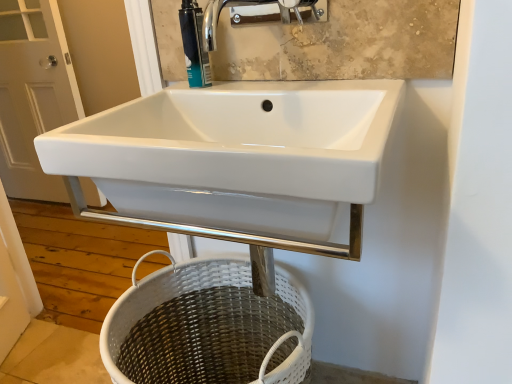
The width and height of the screenshot is (512, 384). Find the location of `white glossy sink at center`. white glossy sink at center is located at coordinates (234, 162).

This screenshot has width=512, height=384. Find the location of `white woven basket at lower center`. white woven basket at lower center is located at coordinates (208, 327).

The height and width of the screenshot is (384, 512). Identify the location of teal plastic soap dispenser at upper center. (194, 45).

Identify the location of white glossy sink at center. The height and width of the screenshot is (384, 512). (234, 162).

Can you confirm if white woven basket at lower center is wider than chrome metallic faucet at upper center?

Yes.

From the image's perspective, relative to chrome metallic faucet at upper center, is white woven basket at lower center above or below?

white woven basket at lower center is below chrome metallic faucet at upper center.

Would you say white woven basket at lower center is a long distance from chrome metallic faucet at upper center?

No, white woven basket at lower center is not far from chrome metallic faucet at upper center.

What are the coordinates of `basket behind the chrome metallic faucet at upper center` in the screenshot? It's located at (208, 327).

Could you tell me if teal plastic soap dispenser at upper center is turned towards chrome metallic faucet at upper center?

No, teal plastic soap dispenser at upper center is not aimed at chrome metallic faucet at upper center.

From a real-world perspective, does teal plastic soap dispenser at upper center sit lower than chrome metallic faucet at upper center?

Correct, in the physical world, teal plastic soap dispenser at upper center is lower than chrome metallic faucet at upper center.

Locate an element on the screen. The width and height of the screenshot is (512, 384). tap on the right of the teal plastic soap dispenser at upper center is located at coordinates (251, 6).

Between teal plastic soap dispenser at upper center and chrome metallic faucet at upper center, which one is positioned behind?

teal plastic soap dispenser at upper center is further from the camera.

Do you think white glossy sink at center is within chrome metallic faucet at upper center, or outside of it?

white glossy sink at center is located beyond the bounds of chrome metallic faucet at upper center.

Who is bigger, white glossy sink at center or chrome metallic faucet at upper center?

With larger size is white glossy sink at center.

Between white glossy sink at center and chrome metallic faucet at upper center, which one has less height?

Standing shorter between the two is chrome metallic faucet at upper center.

From the image's perspective, which is below, white glossy sink at center or chrome metallic faucet at upper center?

white glossy sink at center, from the image's perspective.

Where is `basket located underneath the teal plastic soap dispenser at upper center (from a real-world perspective)`? basket located underneath the teal plastic soap dispenser at upper center (from a real-world perspective) is located at coordinates (208, 327).

Looking at this image, is white woven basket at lower center outside of teal plastic soap dispenser at upper center?

Indeed, white woven basket at lower center is completely outside teal plastic soap dispenser at upper center.

From the image's perspective, is white woven basket at lower center on teal plastic soap dispenser at upper center?

No.

Looking at the image, does white woven basket at lower center seem bigger or smaller compared to teal plastic soap dispenser at upper center?

white woven basket at lower center is bigger than teal plastic soap dispenser at upper center.

From a real-world perspective, between white woven basket at lower center and white glossy sink at center, who is vertically higher?

In real-world perspective, white glossy sink at center is above.

Find the location of a particular element. The width and height of the screenshot is (512, 384). sink in front of the white woven basket at lower center is located at coordinates (234, 162).

Is point (144, 329) behind point (320, 112)?

Yes, it is.

How distant is white woven basket at lower center from white glossy sink at center?

white woven basket at lower center and white glossy sink at center are 11.92 inches apart from each other.

Is white glossy sink at center facing away from white woven basket at lower center?

No, white glossy sink at center's orientation is not away from white woven basket at lower center.

Considering the points (164, 122) and (206, 312), which point is behind, point (164, 122) or point (206, 312)?

The point (206, 312) is more distant.

From the image's perspective, would you say white glossy sink at center is shown under white woven basket at lower center?

No.

From the picture: From a real-world perspective, who is located higher, white glossy sink at center or white woven basket at lower center?

white glossy sink at center.

From the picture: Is chrome metallic faucet at upper center directly adjacent to white woven basket at lower center?

There is a gap between chrome metallic faucet at upper center and white woven basket at lower center.

Is chrome metallic faucet at upper center positioned behind white woven basket at lower center?

No.

Could you tell me if chrome metallic faucet at upper center is turned towards white woven basket at lower center?

No, chrome metallic faucet at upper center is not turned towards white woven basket at lower center.

Where is `tap above the white woven basket at lower center (from a real-world perspective)`? This screenshot has width=512, height=384. tap above the white woven basket at lower center (from a real-world perspective) is located at coordinates (251, 6).

In order to click on tap lying above the white woven basket at lower center (from the image's perspective) in this screenshot , I will do `click(251, 6)`.

Image resolution: width=512 pixels, height=384 pixels. I want to click on tap above the teal plastic soap dispenser at upper center (from a real-world perspective), so click(x=251, y=6).

When comparing their distances from white glossy sink at center, does white woven basket at lower center or white glossy door at left seem further?

Among the two, white glossy door at left is located further to white glossy sink at center.

Which object lies further to the anchor point white glossy door at left, teal plastic soap dispenser at upper center or white glossy sink at center?

The object further to white glossy door at left is white glossy sink at center.

Based on their spatial positions, is chrome metallic faucet at upper center or teal plastic soap dispenser at upper center closer to white glossy door at left?

Among the two, teal plastic soap dispenser at upper center is located nearer to white glossy door at left.

Considering their positions, is chrome metallic faucet at upper center positioned closer to teal plastic soap dispenser at upper center than white glossy sink at center?

chrome metallic faucet at upper center lies closer to teal plastic soap dispenser at upper center than the other object.

Based on their spatial positions, is teal plastic soap dispenser at upper center or white glossy door at left further from white glossy sink at center?

white glossy door at left lies further to white glossy sink at center than the other object.

From the image, which object appears to be nearer to white glossy door at left, white woven basket at lower center or white glossy sink at center?

Among the two, white woven basket at lower center is located nearer to white glossy door at left.

From the image, which object appears to be farther from chrome metallic faucet at upper center, white glossy door at left or white glossy sink at center?

Based on the image, white glossy door at left appears to be further to chrome metallic faucet at upper center.

Estimate the real-world distances between objects in this image. Which object is further from chrome metallic faucet at upper center, teal plastic soap dispenser at upper center or white woven basket at lower center?

white woven basket at lower center lies further to chrome metallic faucet at upper center than the other object.

The width and height of the screenshot is (512, 384). I want to click on soap dispenser positioned between white woven basket at lower center and white glossy door at left from near to far, so click(194, 45).

Image resolution: width=512 pixels, height=384 pixels. Find the location of `soap dispenser between chrome metallic faucet at upper center and white woven basket at lower center in the up-down direction`. soap dispenser between chrome metallic faucet at upper center and white woven basket at lower center in the up-down direction is located at coordinates (194, 45).

Find the location of `soap dispenser positioned between chrome metallic faucet at upper center and white glossy door at left from near to far`. soap dispenser positioned between chrome metallic faucet at upper center and white glossy door at left from near to far is located at coordinates (194, 45).

Locate an element on the screen. This screenshot has width=512, height=384. tap located between white glossy sink at center and teal plastic soap dispenser at upper center in the depth direction is located at coordinates (251, 6).